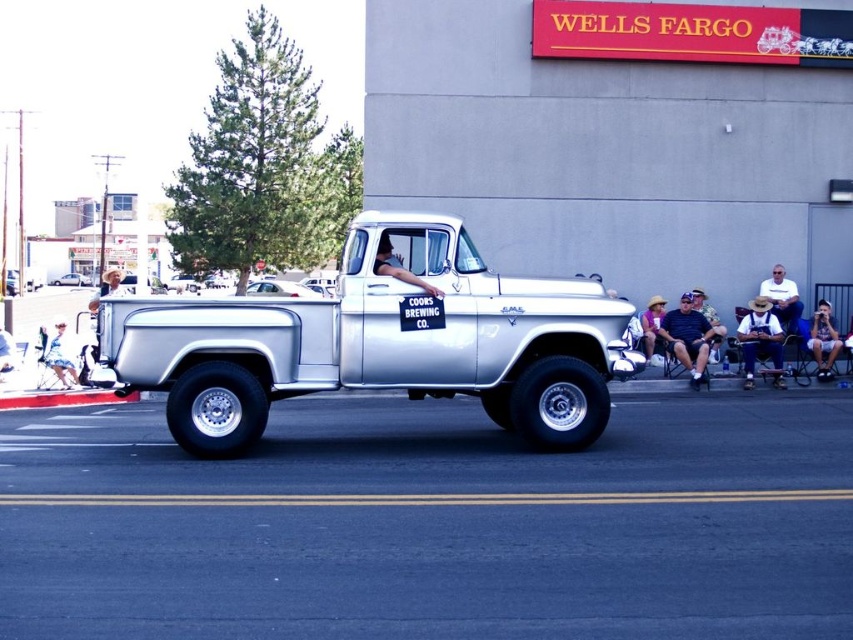
Question: Which of these objects is positioned farthest from the camouflage fabric shirt at center?

Choices:
 (A) brown corduroy overalls at right
 (B) gray fabric shorts at right
 (C) brushed metal truck at center

Answer: (C)

Question: Can you confirm if brown corduroy overalls at right is wider than white cotton dress at lower left?

Choices:
 (A) yes
 (B) no

Answer: (B)

Question: Which object appears closest to the camera in this image?

Choices:
 (A) silver metallic truck at center
 (B) dark blue jeans at center
 (C) camouflage fabric shirt at center

Answer: (A)

Question: Is the position of white cotton shirt at right less distant than that of purple cotton shirt at center?

Choices:
 (A) no
 (B) yes

Answer: (A)

Question: Does white cotton shirt at right appear under white cotton dress at lower left?

Choices:
 (A) no
 (B) yes

Answer: (A)

Question: Which point is farther to the camera?

Choices:
 (A) (68, 346)
 (B) (821, 301)
 (C) (647, 307)

Answer: (A)